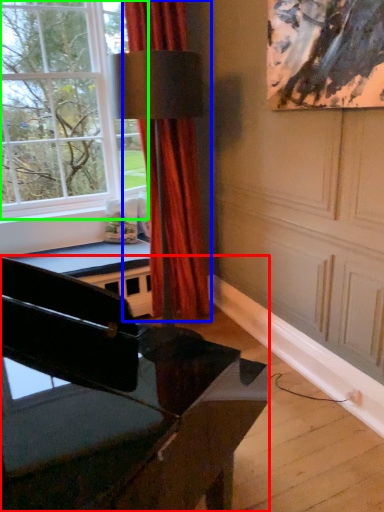
Question: Estimate the real-world distances between objects in this image. Which object is closer to piano (highlighted by a red box), curtain (highlighted by a blue box) or window (highlighted by a green box)?

Choices:
 (A) curtain
 (B) window

Answer: (A)